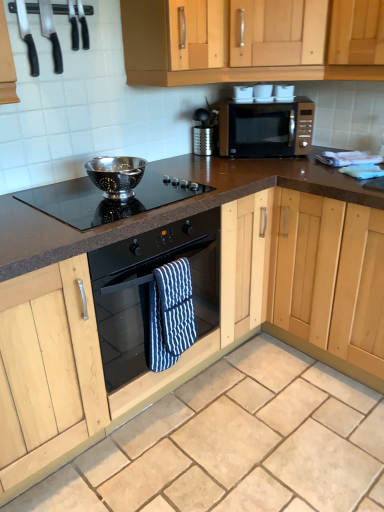
Question: Is black glass oven at center inside satin gold microwave at upper center?

Choices:
 (A) no
 (B) yes

Answer: (A)

Question: Can you confirm if satin gold microwave at upper center is shorter than black glass oven at center?

Choices:
 (A) no
 (B) yes

Answer: (B)

Question: Is satin gold microwave at upper center beside black glass oven at center?

Choices:
 (A) yes
 (B) no

Answer: (B)

Question: Considering the relative sizes of satin gold microwave at upper center and black glass oven at center in the image provided, is satin gold microwave at upper center wider than black glass oven at center?

Choices:
 (A) yes
 (B) no

Answer: (B)

Question: Is satin gold microwave at upper center far from black glass oven at center?

Choices:
 (A) no
 (B) yes

Answer: (A)

Question: Considering their positions, is black glass cooktop at center located in front of or behind beige granite countertop at center?

Choices:
 (A) front
 (B) behind

Answer: (B)

Question: Considering the relative positions of black glass cooktop at center and beige granite countertop at center in the image provided, is black glass cooktop at center to the left or to the right of beige granite countertop at center?

Choices:
 (A) right
 (B) left

Answer: (B)

Question: Would you say black glass cooktop at center is inside or outside beige granite countertop at center?

Choices:
 (A) outside
 (B) inside

Answer: (A)

Question: Considering the positions of point (87, 187) and point (67, 501), is point (87, 187) closer or farther from the camera than point (67, 501)?

Choices:
 (A) farther
 (B) closer

Answer: (A)

Question: From a real-world perspective, is black glass oven at center physically located above or below beige granite countertop at center?

Choices:
 (A) below
 (B) above

Answer: (B)

Question: Considering the positions of point (213, 244) and point (377, 498), is point (213, 244) closer or farther from the camera than point (377, 498)?

Choices:
 (A) closer
 (B) farther

Answer: (B)

Question: From the image's perspective, is black glass oven at center located above or below beige granite countertop at center?

Choices:
 (A) below
 (B) above

Answer: (B)

Question: Would you say black glass oven at center is to the left or to the right of beige granite countertop at center in the picture?

Choices:
 (A) left
 (B) right

Answer: (A)

Question: Considering their positions, is black glass oven at center located in front of or behind blue striped oven mitt at center?

Choices:
 (A) behind
 (B) front

Answer: (B)

Question: Considering the positions of black glass oven at center and blue striped oven mitt at center in the image, is black glass oven at center wider or thinner than blue striped oven mitt at center?

Choices:
 (A) thin
 (B) wide

Answer: (B)